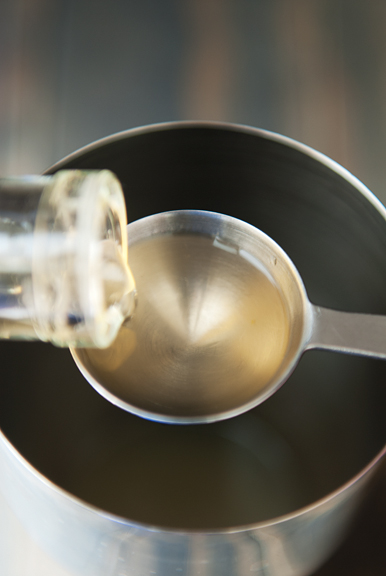
At what (x,y) coordinates should I click in order to perform the action: click on measuring spoon. Please return your answer as a coordinate pair (x, y). Image resolution: width=386 pixels, height=576 pixels. Looking at the image, I should click on (262, 242).